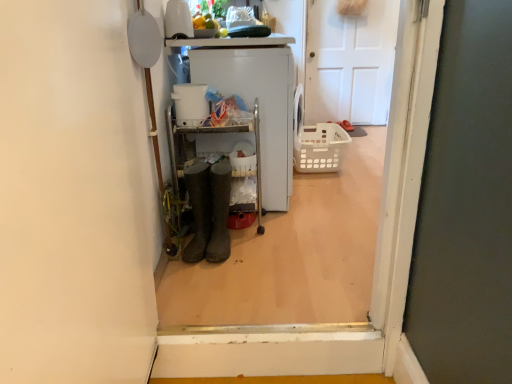
Where is `free spot below brown rubber boots at center, arranged as the 1th footwear when viewed from the right (from a real-world perspective)`? Image resolution: width=512 pixels, height=384 pixels. free spot below brown rubber boots at center, arranged as the 1th footwear when viewed from the right (from a real-world perspective) is located at coordinates pos(222,259).